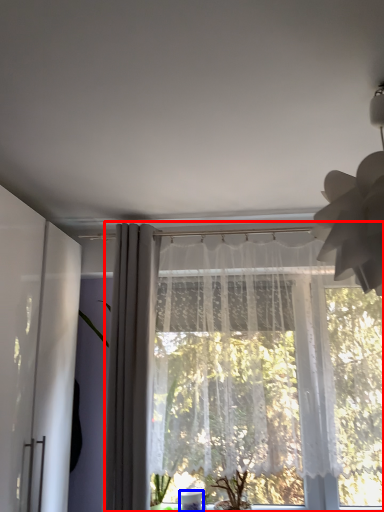
Question: Which of the following is the farthest to the observer, curtain (highlighted by a red box) or glass vase (highlighted by a blue box)?

Choices:
 (A) curtain
 (B) glass vase

Answer: (B)